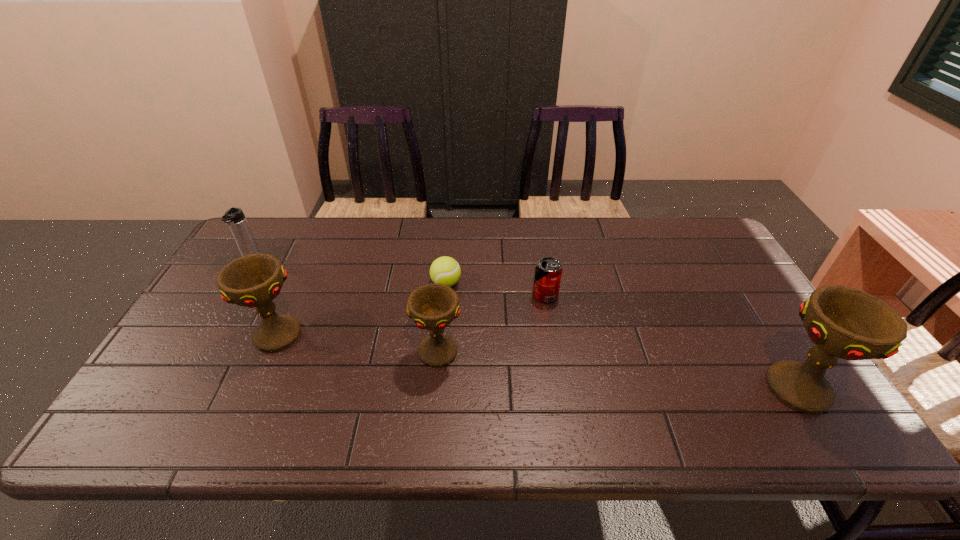
At what (x,y) coordinates should I click in order to perform the action: click on empty space between the rightmost chalice and the leftmost chalice. Please return your answer as a coordinate pair (x, y). The width and height of the screenshot is (960, 540). Looking at the image, I should click on (537, 361).

The width and height of the screenshot is (960, 540). What are the coordinates of `empty space between the rightmost chalice and the fifth object from right to left` in the screenshot? It's located at (537, 361).

Locate an element on the screen. The width and height of the screenshot is (960, 540). free space between the leftmost object and the shortest chalice is located at coordinates (345, 306).

Where is `free point between the leftmost object and the shortest object`? The height and width of the screenshot is (540, 960). free point between the leftmost object and the shortest object is located at coordinates (348, 272).

Locate an element on the screen. This screenshot has width=960, height=540. vacant area that lies between the second chalice from right to left and the soda can is located at coordinates (492, 323).

At what (x,y) coordinates should I click in order to perform the action: click on free space between the shortest chalice and the rightmost chalice. Please return your answer as a coordinate pair (x, y). This screenshot has width=960, height=540. Looking at the image, I should click on (617, 370).

Locate an element on the screen. vacant region between the second tallest chalice and the second chalice from left to right is located at coordinates (357, 343).

Where is `vacant area between the shortest object and the second tallest object`? The width and height of the screenshot is (960, 540). vacant area between the shortest object and the second tallest object is located at coordinates (361, 309).

Where is `the closest object relative to the fifth shortest object`? the closest object relative to the fifth shortest object is located at coordinates (234, 217).

Identify the location of object that is the third nearest to the shortest object. The width and height of the screenshot is (960, 540). (254, 280).